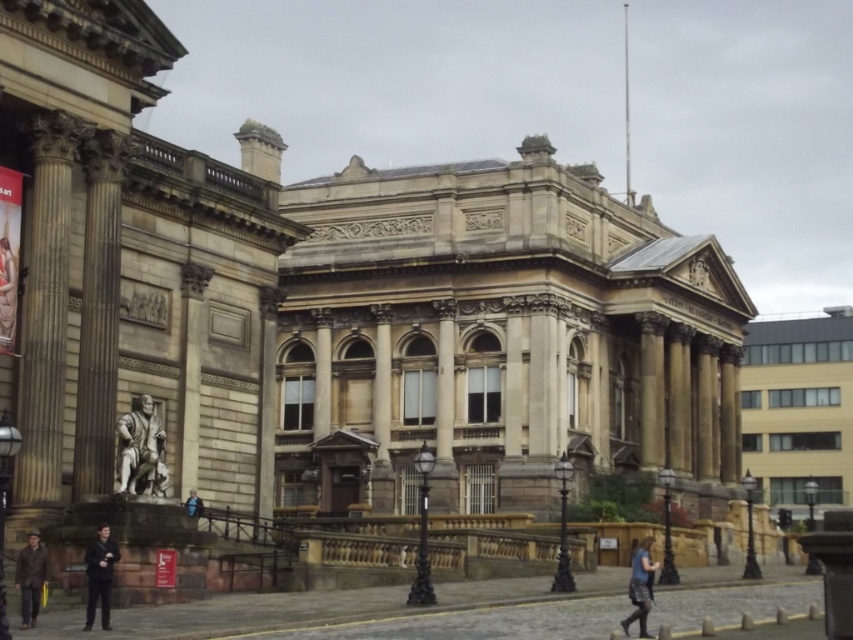
Does leather jacket at lower left appear under blue fabric jacket at lower center?

Yes, leather jacket at lower left is below blue fabric jacket at lower center.

Which is above, leather jacket at lower left or blue fabric jacket at lower center?

→ blue fabric jacket at lower center

Who is more distant from viewer, (27, 600) or (202, 506)?

The point (202, 506) is behind.

Locate an element on the screen. leather jacket at lower left is located at coordinates (30, 579).

Can you confirm if bronze statue at lower left is positioned to the left of dark gray suit at lower left?

Indeed, bronze statue at lower left is positioned on the left side of dark gray suit at lower left.

Image resolution: width=853 pixels, height=640 pixels. Find the location of `bronze statue at lower left`. bronze statue at lower left is located at coordinates (141, 449).

I want to click on bronze statue at lower left, so click(141, 449).

Does dark gray suit at lower left appear on the right side of leather jacket at lower left?

Indeed, dark gray suit at lower left is positioned on the right side of leather jacket at lower left.

In the scene shown: Is dark gray suit at lower left smaller than leather jacket at lower left?

No, dark gray suit at lower left is not smaller than leather jacket at lower left.

This screenshot has height=640, width=853. I want to click on dark gray suit at lower left, so click(99, 576).